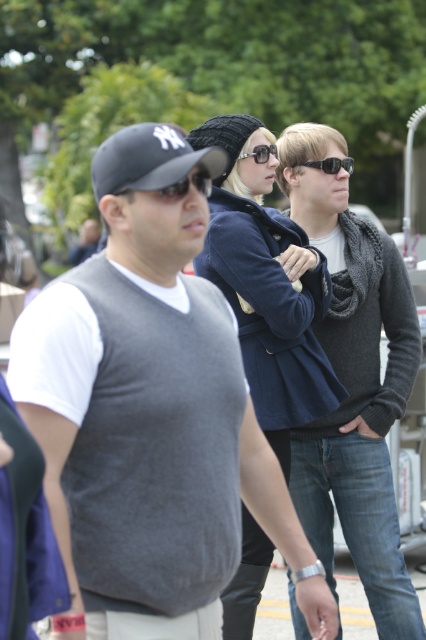
Question: Which of the following is the farthest from the observer?

Choices:
 (A) (212, 154)
 (B) (321, 170)

Answer: (B)

Question: Which point is closer to the camera taking this photo?

Choices:
 (A) (109, 196)
 (B) (347, 163)
 (C) (264, 310)
 (D) (264, 160)

Answer: (A)

Question: Does gray knit vest at center appear on the right side of navy blue coat at center?

Choices:
 (A) no
 (B) yes

Answer: (A)

Question: Is gray knit vest at center to the right of dark gray matte baseball cap at center from the viewer's perspective?

Choices:
 (A) yes
 (B) no

Answer: (B)

Question: Among these objects, which one is farthest from the camera?

Choices:
 (A) gray knit vest at center
 (B) black plastic sunglasses at center
 (C) dark gray matte baseball cap at center
 (D) shiny silver sunglasses at center

Answer: (B)

Question: From the image, what is the correct spatial relationship of gray knit vest at center in relation to navy blue coat at center?

Choices:
 (A) right
 (B) left

Answer: (B)